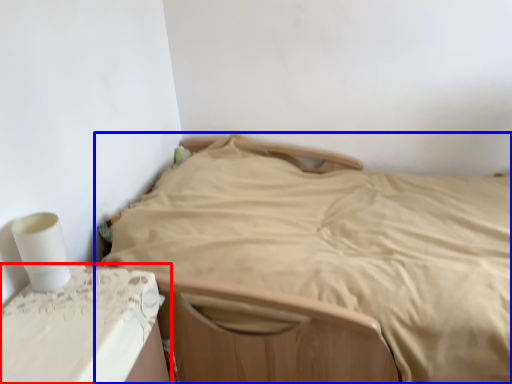
Question: Which point is further to the camera, furniture (highlighted by a red box) or bed (highlighted by a blue box)?

Choices:
 (A) furniture
 (B) bed

Answer: (B)